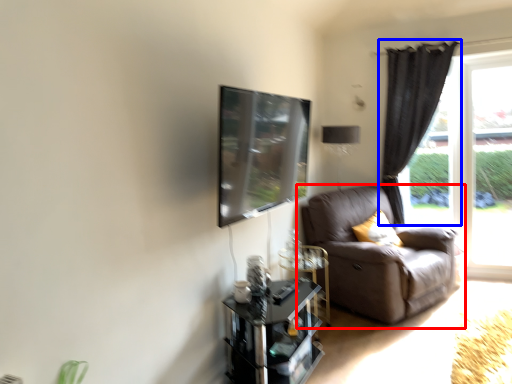
Question: Which object is closer to the camera taking this photo, studio couch (highlighted by a red box) or curtain (highlighted by a blue box)?

Choices:
 (A) studio couch
 (B) curtain

Answer: (A)